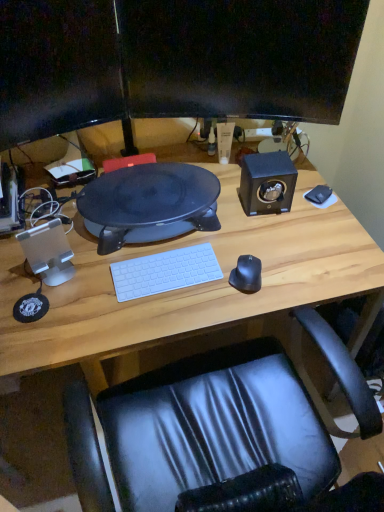
Question: Would you say black matte mouse at right is inside or outside transparent plastic speaker at left, which is counted as the first speaker, starting from the front?

Choices:
 (A) outside
 (B) inside

Answer: (A)

Question: Is point (254, 276) positioned closer to the camera than point (36, 237)?

Choices:
 (A) farther
 (B) closer

Answer: (A)

Question: Which is farther from the white matte keyboard at center?

Choices:
 (A) black matte speaker at upper right, the 1th speaker positioned from the right
 (B) black glossy monitor at upper center, which is the 2th computer monitor from left to right
 (C) matte black monitor at upper center, which is counted as the 2th computer monitor, starting from the right
 (D) wooden desk at center
 (E) black matte mousepad at right

Answer: (B)

Question: Estimate the real-world distances between objects in this image. Which object is farther from the wooden desk at center?

Choices:
 (A) transparent plastic speaker at left, which appears as the second speaker when viewed from the top
 (B) matte black monitor at upper center, which is counted as the 2th computer monitor, starting from the right
 (C) black matte mousepad at right
 (D) black matte mouse at right
 (E) white matte keyboard at center

Answer: (B)